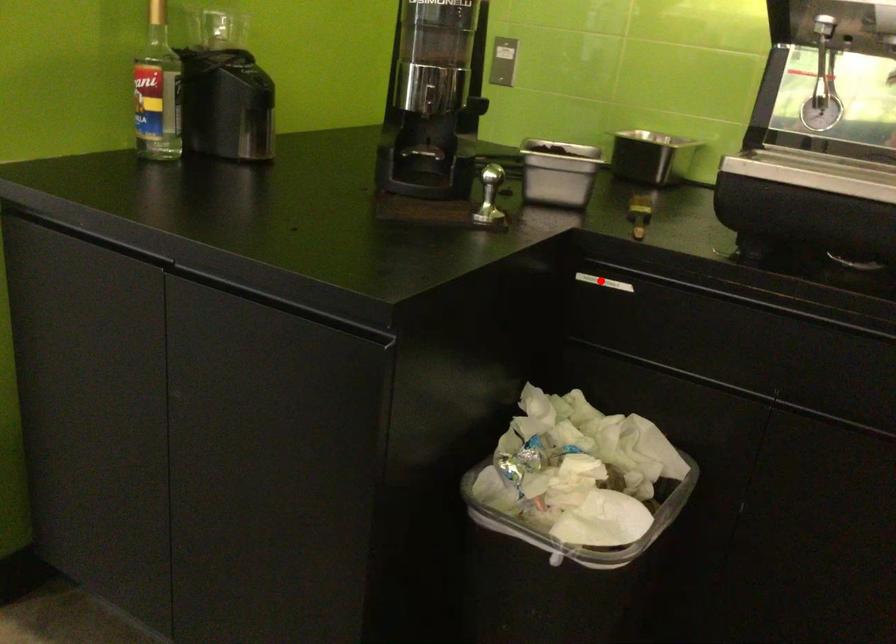
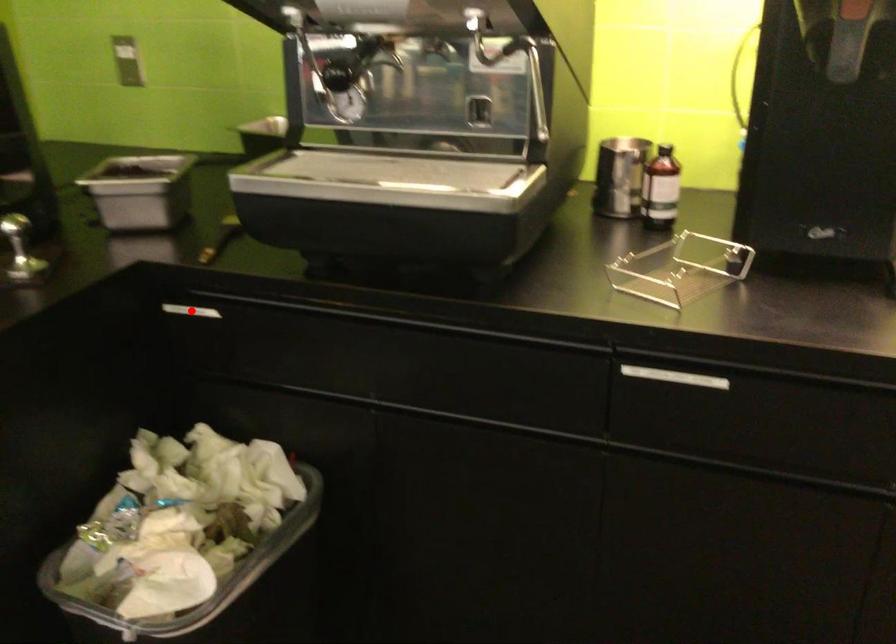
I am providing you with two images of the same scene from different viewpoints. A red point is marked on the first image and another point is marked on the second image. Does the point marked in image1 correspond to the same location as the one in image2?

Yes